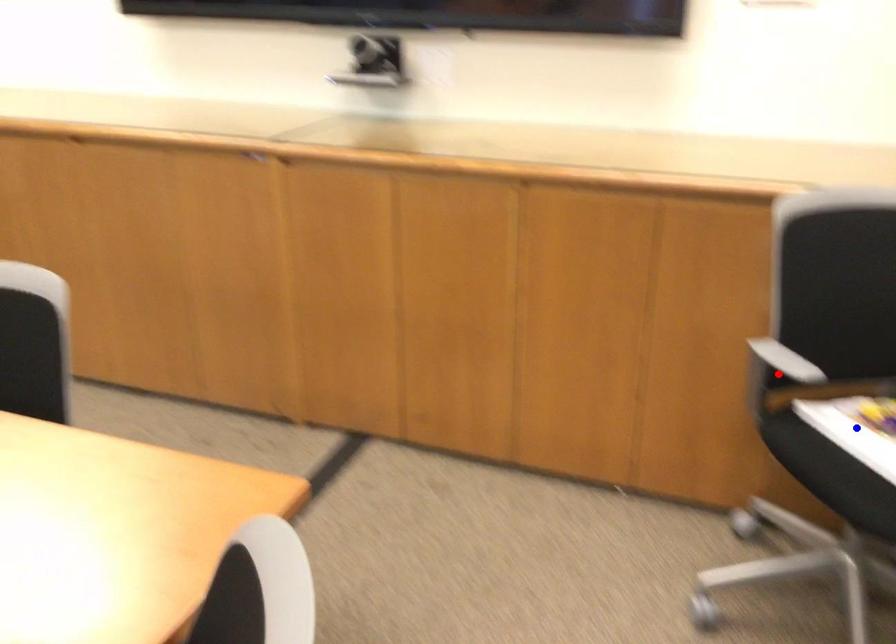
Question: In the image, two points are highlighted. Which point is nearer to the camera? Reply with the corresponding letter.

Choices:
 (A) blue point
 (B) red point

Answer: (B)